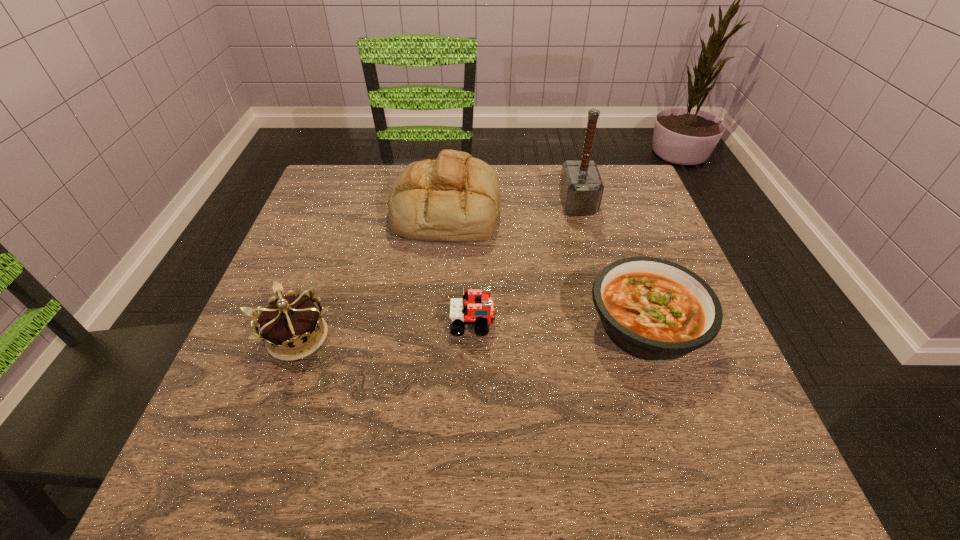
Point out which object is positioned as the fourth nearest to the hammer. Please provide its 2D coordinates. Your answer should be formatted as a tuple, i.e. [(x, y)], where the tuple contains the x and y coordinates of a point satisfying the conditions above.

[(289, 326)]

Identify which object is the second nearest to the tallest object. Please provide its 2D coordinates. Your answer should be formatted as a tuple, i.e. [(x, y)], where the tuple contains the x and y coordinates of a point satisfying the conditions above.

[(656, 310)]

Find the location of a particular element. This screenshot has height=540, width=960. free location that satisfies the following two spatial constraints: 1. on the front-facing side of the Lego; 2. on the front side of the third shortest object is located at coordinates (473, 337).

Identify the location of vacant area in the image that satisfies the following two spatial constraints: 1. on the back side of the crown; 2. on the left side of the stew. (301, 326).

The height and width of the screenshot is (540, 960). What are the coordinates of `free space that satisfies the following two spatial constraints: 1. on the back side of the stew; 2. on the front-facing side of the Lego` in the screenshot? It's located at (644, 323).

At what (x,y) coordinates should I click in order to perform the action: click on free space that satisfies the following two spatial constraints: 1. on the front-facing side of the Lego; 2. on the front side of the third shortest object. Please return your answer as a coordinate pair (x, y). Image resolution: width=960 pixels, height=540 pixels. Looking at the image, I should click on (473, 337).